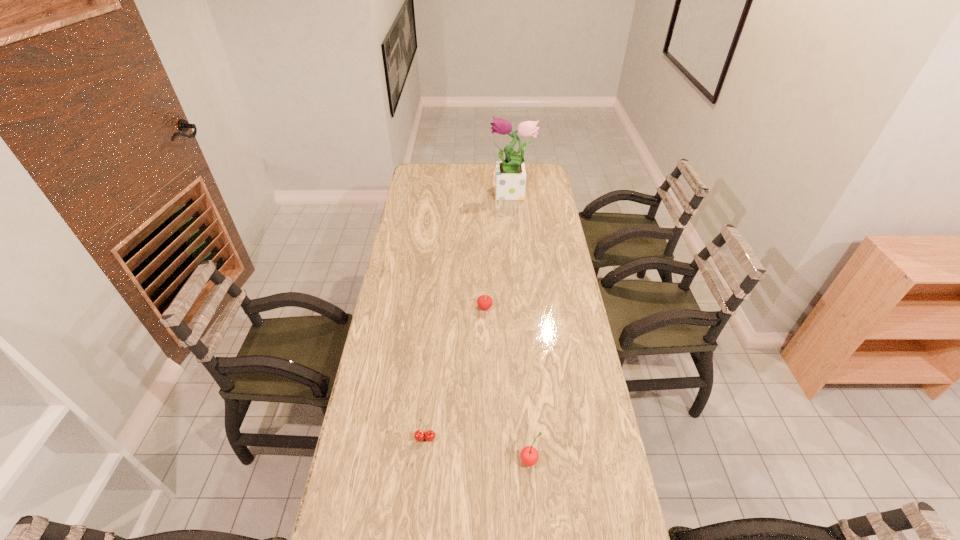
Locate an element on the screen. the farthest object is located at coordinates (510, 178).

At what (x,y) coordinates should I click in order to perform the action: click on the tallest object. Please return your answer as a coordinate pair (x, y). Looking at the image, I should click on (510, 178).

The image size is (960, 540). Find the location of `the third nearest object`. the third nearest object is located at coordinates (484, 302).

The image size is (960, 540). I want to click on the farthest cherry, so click(484, 302).

Identify the location of the nearest cherry. (529, 455).

Locate an element on the screen. The height and width of the screenshot is (540, 960). the rightmost cherry is located at coordinates (529, 455).

This screenshot has height=540, width=960. Identify the location of the third farthest object. (419, 435).

Identify the location of the shortest cherry. (419, 435).

Where is `vacant space located on the front-facing side of the flower arrangement`? This screenshot has width=960, height=540. vacant space located on the front-facing side of the flower arrangement is located at coordinates (465, 195).

Where is `blank area located 0.230m on the front-facing side of the flower arrangement`? blank area located 0.230m on the front-facing side of the flower arrangement is located at coordinates (445, 195).